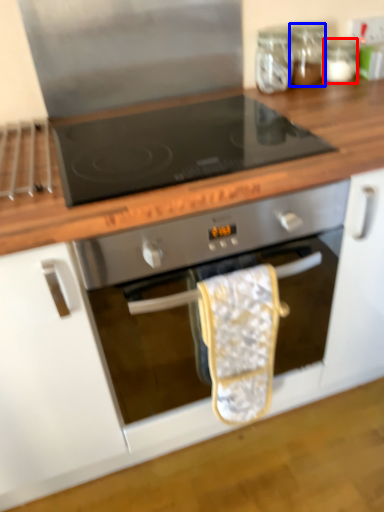
Question: Which object is closer to the camera taking this photo, glass jar (highlighted by a red box) or glass jar (highlighted by a blue box)?

Choices:
 (A) glass jar
 (B) glass jar

Answer: (B)